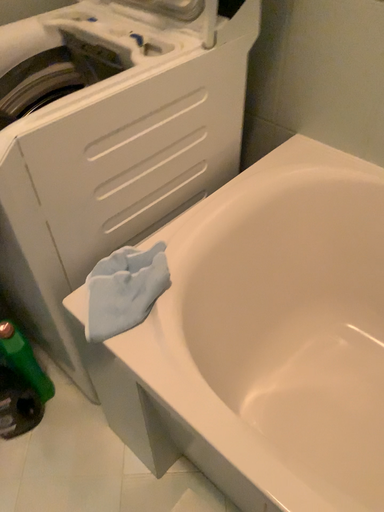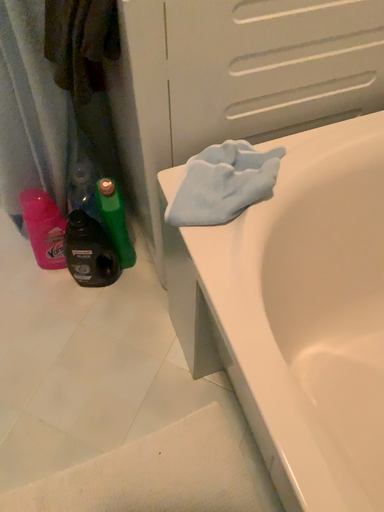
Question: How did the camera likely rotate when shooting the video?

Choices:
 (A) rotated upward
 (B) rotated downward

Answer: (B)